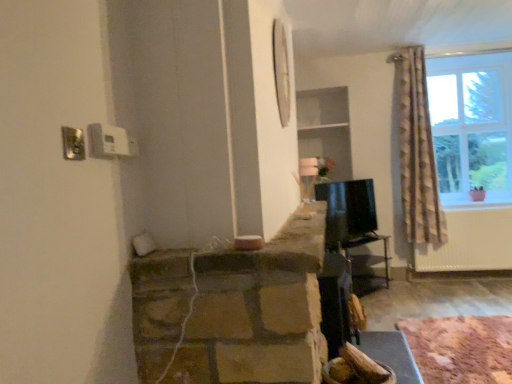
Describe the element at coordinates (461, 348) in the screenshot. I see `rustic wooden logs at lower right` at that location.

Identify the location of rustic wooden logs at lower right. (461, 348).

Where is `metallic dark brown table at center`? metallic dark brown table at center is located at coordinates (367, 243).

The width and height of the screenshot is (512, 384). Describe the element at coordinates (367, 243) in the screenshot. I see `metallic dark brown table at center` at that location.

Where is `rustic wooden logs at lower right`? Image resolution: width=512 pixels, height=384 pixels. rustic wooden logs at lower right is located at coordinates (461, 348).

Can you confirm if rustic wooden logs at lower right is positioned to the right of metallic dark brown table at center?

Correct, you'll find rustic wooden logs at lower right to the right of metallic dark brown table at center.

Is rustic wooden logs at lower right closer to camera compared to metallic dark brown table at center?

That is True.

Between point (501, 363) and point (347, 256), which one is positioned in front?

Point (501, 363)

From the image's perspective, is rustic wooden logs at lower right under metallic dark brown table at center?

Indeed, from the image's perspective, rustic wooden logs at lower right is shown beneath metallic dark brown table at center.

From a real-world perspective, does rustic wooden logs at lower right stand above metallic dark brown table at center?

No, from a real-world perspective, rustic wooden logs at lower right is not above metallic dark brown table at center.

Which of these two, rustic wooden logs at lower right or metallic dark brown table at center, is wider?

rustic wooden logs at lower right.

Does rustic wooden logs at lower right have a lesser height compared to metallic dark brown table at center?

Indeed, rustic wooden logs at lower right has a lesser height compared to metallic dark brown table at center.

Considering the relative sizes of rustic wooden logs at lower right and metallic dark brown table at center in the image provided, is rustic wooden logs at lower right bigger than metallic dark brown table at center?

No.

Is rustic wooden logs at lower right situated inside metallic dark brown table at center or outside?

The correct answer is: outside.

Are rustic wooden logs at lower right and metallic dark brown table at center far apart?

Yes, rustic wooden logs at lower right is far from metallic dark brown table at center.

Is rustic wooden logs at lower right facing towards metallic dark brown table at center?

No, rustic wooden logs at lower right is not turned towards metallic dark brown table at center.

How different are the orientations of rustic wooden logs at lower right and metallic dark brown table at center in degrees?

The angular difference between rustic wooden logs at lower right and metallic dark brown table at center is 36.5 degrees.

The width and height of the screenshot is (512, 384). Identify the location of plain in front of the metallic dark brown table at center. (461, 348).

Would you say metallic dark brown table at center is to the left or to the right of rustic wooden logs at lower right in the picture?

metallic dark brown table at center is positioned on rustic wooden logs at lower right's left side.

Who is more distant, metallic dark brown table at center or rustic wooden logs at lower right?

metallic dark brown table at center is behind.

Considering the points (370, 236) and (408, 341), which point is in front, point (370, 236) or point (408, 341)?

The point (408, 341) is in front.

From the image's perspective, which one is positioned lower, metallic dark brown table at center or rustic wooden logs at lower right?

rustic wooden logs at lower right appears lower in the image.

In the scene shown: From a real-world perspective, relative to rustic wooden logs at lower right, is metallic dark brown table at center vertically above or below?

A: In terms of real-world spatial position, metallic dark brown table at center is above rustic wooden logs at lower right.

Looking at their sizes, would you say metallic dark brown table at center is wider or thinner than rustic wooden logs at lower right?

In the image, metallic dark brown table at center appears to be more narrow than rustic wooden logs at lower right.

Which of these two, metallic dark brown table at center or rustic wooden logs at lower right, stands taller?

metallic dark brown table at center is taller.

Between metallic dark brown table at center and rustic wooden logs at lower right, which one has smaller size?

With smaller size is rustic wooden logs at lower right.

Is rustic wooden logs at lower right surrounded by metallic dark brown table at center?

No, rustic wooden logs at lower right is not surrounded by metallic dark brown table at center.

Is metallic dark brown table at center positioned far away from rustic wooden logs at lower right?

Indeed, metallic dark brown table at center is not near rustic wooden logs at lower right.

Is metallic dark brown table at center positioned with its back to rustic wooden logs at lower right?

No, metallic dark brown table at center is not facing away from rustic wooden logs at lower right.

Can you tell me how much metallic dark brown table at center and rustic wooden logs at lower right differ in facing direction?

The facing directions of metallic dark brown table at center and rustic wooden logs at lower right are 36.5 degrees apart.

Where is `plain in front of the metallic dark brown table at center`? The image size is (512, 384). plain in front of the metallic dark brown table at center is located at coordinates (461, 348).

Image resolution: width=512 pixels, height=384 pixels. What are the coordinates of `plain in front of the metallic dark brown table at center` in the screenshot? It's located at (461, 348).

In the image, there is a metallic dark brown table at center. Where is `plain below it (from a real-world perspective)`? This screenshot has width=512, height=384. plain below it (from a real-world perspective) is located at coordinates (461, 348).